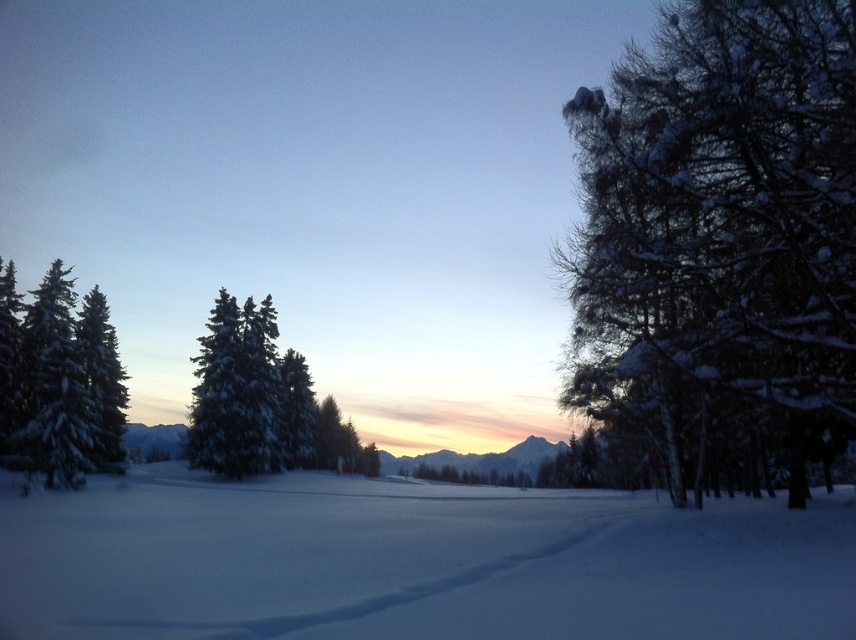
Question: Is white fluffy snow at center behind snow-covered evergreen at center?

Choices:
 (A) no
 (B) yes

Answer: (A)

Question: Which object is farther from the camera taking this photo?

Choices:
 (A) snow-covered evergreen at center
 (B) snow-covered branches at right
 (C) white snow-covered tree at left
 (D) white fluffy snow at center

Answer: (A)

Question: Which of the following is the closest to the observer?

Choices:
 (A) snow-covered evergreen at center
 (B) white snow-covered tree at left
 (C) white fluffy snow at center

Answer: (C)

Question: Which of these objects is positioned closest to the white fluffy snow at center?

Choices:
 (A) snow-covered evergreen at center
 (B) snow-covered branches at right
 (C) white snow-covered tree at left

Answer: (B)

Question: Is white fluffy snow at center bigger than white snow-covered tree at left?

Choices:
 (A) yes
 (B) no

Answer: (A)

Question: Considering the relative positions of white snow-covered tree at left and snow-covered evergreen at center in the image provided, where is white snow-covered tree at left located with respect to snow-covered evergreen at center?

Choices:
 (A) left
 (B) right

Answer: (A)